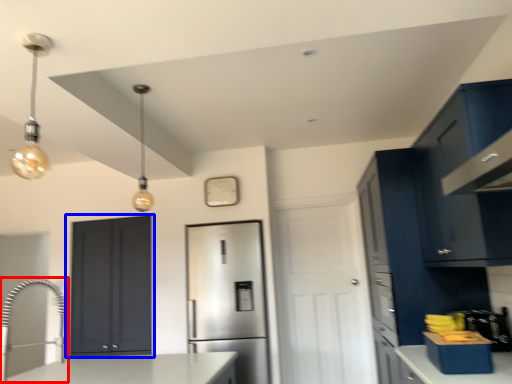
Question: Which object is closer to the camera taking this photo, faucet (highlighted by a red box) or door (highlighted by a blue box)?

Choices:
 (A) faucet
 (B) door

Answer: (A)